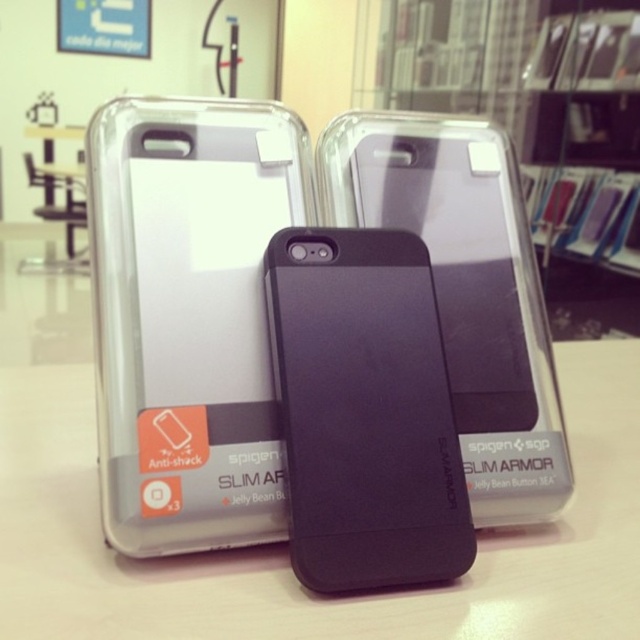
You are setting up a display for a store. You have a white matte table at center and a matte black phone at center. Which object should you place first if you want to ensure the smaller item fits properly on top?

You should place the white matte table at center first because it is larger than the matte black phone at center, allowing the smaller phone to be placed on top appropriately.

You are standing in front of the display setup and want to place a new smartphone case exactly at the point labeled as point (285, 547). Based on the scene description, where should you place it?

The point (285, 547) is located on the white matte table at center, so you should place the new smartphone case there.

You are arranging items on a desk and have a white matte table at center and a matte black phone at center. According to the scene, which item is positioned to the left?

The white matte table at center is to the left of the matte black phone at center.